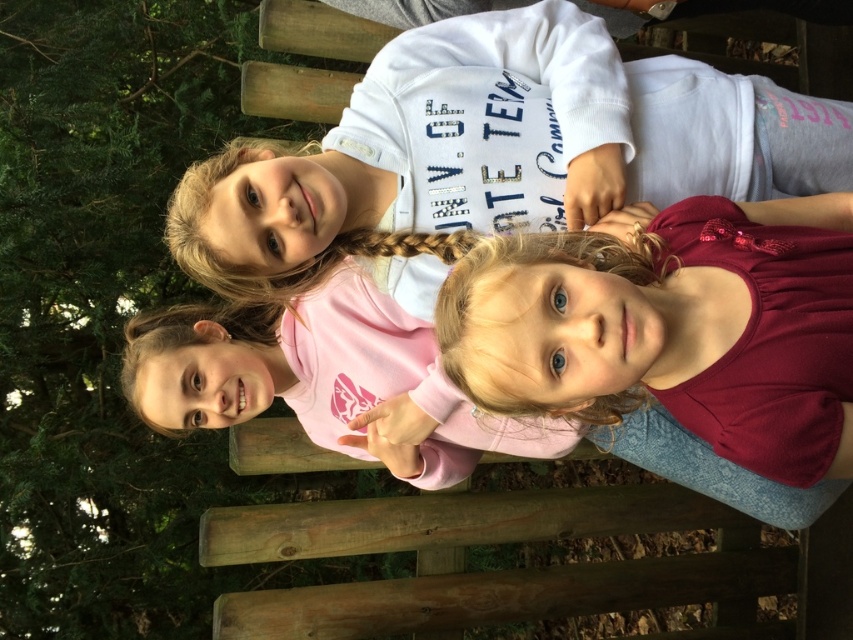
Can you confirm if white cotton shirt at upper center is smaller than pink matte shirt at center?

Correct, white cotton shirt at upper center occupies less space than pink matte shirt at center.

Between point (328, 252) and point (437, 422), which one is positioned behind?

Point (437, 422)

Is point (521, 186) less distant than point (173, 410)?

Yes.

What are the coordinates of `white cotton shirt at upper center` in the screenshot? It's located at (492, 154).